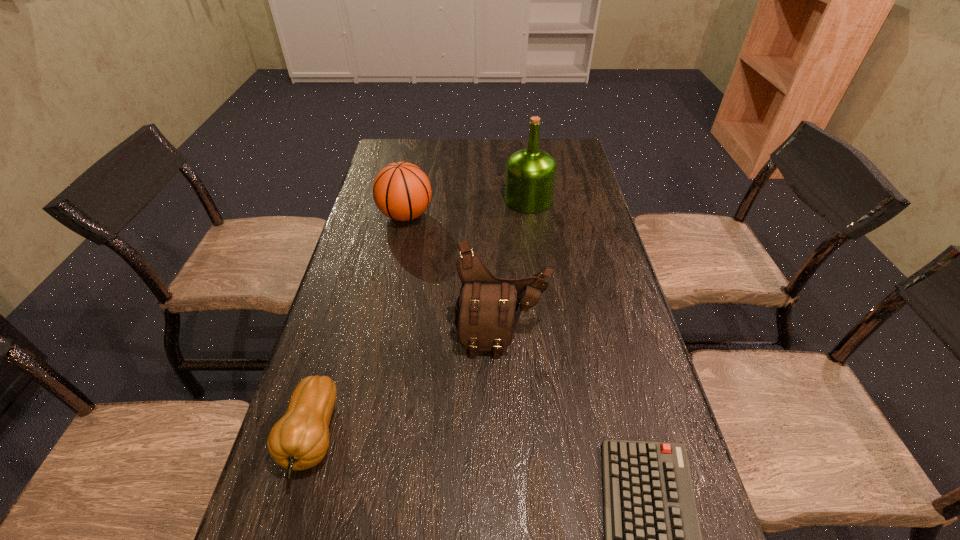
Find the location of a particular element. olive oil is located at coordinates (530, 176).

What are the coordinates of `the third nearest object` in the screenshot? It's located at (487, 310).

This screenshot has width=960, height=540. What are the coordinates of `the second tallest object` in the screenshot? It's located at (487, 310).

I want to click on basketball, so click(401, 191).

Locate an element on the screen. the second shortest object is located at coordinates (299, 440).

At what (x,y) coordinates should I click in order to perform the action: click on blank area located on the back of the olive oil. Please return your answer as a coordinate pair (x, y). The image size is (960, 540). Looking at the image, I should click on (524, 167).

You are a GUI agent. You are given a task and a screenshot of the screen. Output one action in this format:
    pyautogui.click(x=<x>, y=<y>)
    Task: Click on the vacant area situated on the front-facing side of the third farthest object
    The image size is (960, 540).
    Given the screenshot: What is the action you would take?
    pyautogui.click(x=510, y=522)

Image resolution: width=960 pixels, height=540 pixels. Identify the location of vacant region located 0.310m on the right of the basketball. (531, 215).

Locate an element on the screen. basketball present at the left edge is located at coordinates (401, 191).

Find the location of `gourd located in the left edge section of the desktop`. gourd located in the left edge section of the desktop is located at coordinates (299, 440).